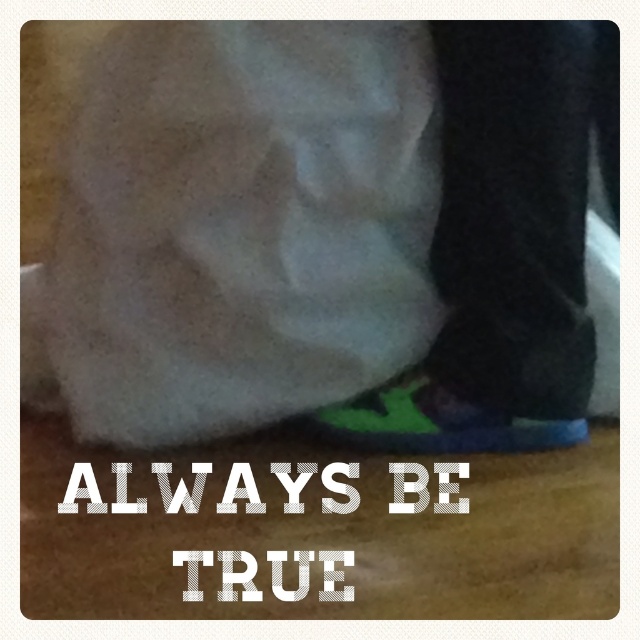
In the scene shown: You are a photographer adjusting your camera to focus on the green fabric shoe at lower right and the green suede shoe at lower center. Which shoe should you focus on first if you want to capture both clearly in the same frame?

You should focus on the green fabric shoe at lower right first because it is closer to the viewer than the green suede shoe at lower center, ensuring both are in focus when using depth of field.

You are a fashion designer examining a pair of shoes in an image. You notice the green fabric shoe at lower right and the green suede shoe at lower center. Which shoe is positioned higher in the image?

The green fabric shoe at lower right is positioned higher than the green suede shoe at lower center in the image.

You are a fashion designer assessing a client who is wearing two different green shoes. The client has a green fabric shoe at lower right and a green suede shoe at lower center. Which of these shoes is taller?

The green fabric shoe at lower right is taller than the green suede shoe at lower center.